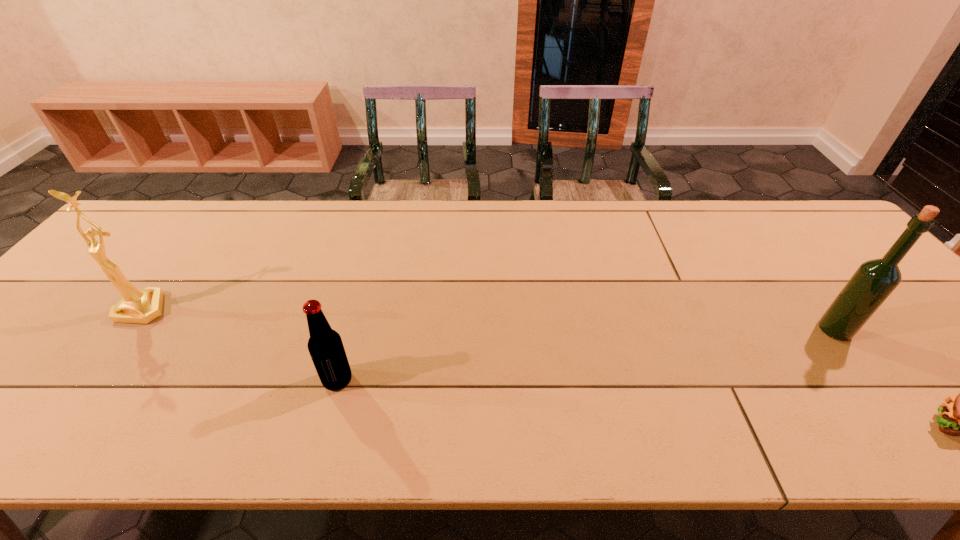
Image resolution: width=960 pixels, height=540 pixels. Find the location of `liquor`. liquor is located at coordinates (874, 280).

I want to click on the leftmost object, so click(142, 306).

You are a GUI agent. You are given a task and a screenshot of the screen. Output one action in this format:
    pyautogui.click(x=<x>, y=<y>)
    Task: Click on the third tallest object
    
    Given the screenshot: What is the action you would take?
    pyautogui.click(x=325, y=345)

You are a GUI agent. You are given a task and a screenshot of the screen. Output one action in this format:
    pyautogui.click(x=<x>, y=<y>)
    Task: Click on the beer bottle
    Image resolution: width=960 pixels, height=540 pixels.
    Given the screenshot: What is the action you would take?
    pyautogui.click(x=325, y=345)

Identify the location of free region located 0.190m on the front of the third object from left to right. The width and height of the screenshot is (960, 540). (900, 417).

Locate an element on the screen. Image resolution: width=960 pixels, height=540 pixels. free location located on the front-facing side of the award is located at coordinates (113, 348).

Find the location of a particular element. This screenshot has height=540, width=960. vacant space located on the back of the third farthest object is located at coordinates (362, 291).

Find the location of a particular element. vacant region at the far edge of the desktop is located at coordinates (366, 213).

Find the location of a particular element. Image resolution: width=960 pixels, height=540 pixels. free space at the near edge is located at coordinates (564, 422).

In order to click on vacant space at the right edge of the desktop in this screenshot , I will do `click(855, 271)`.